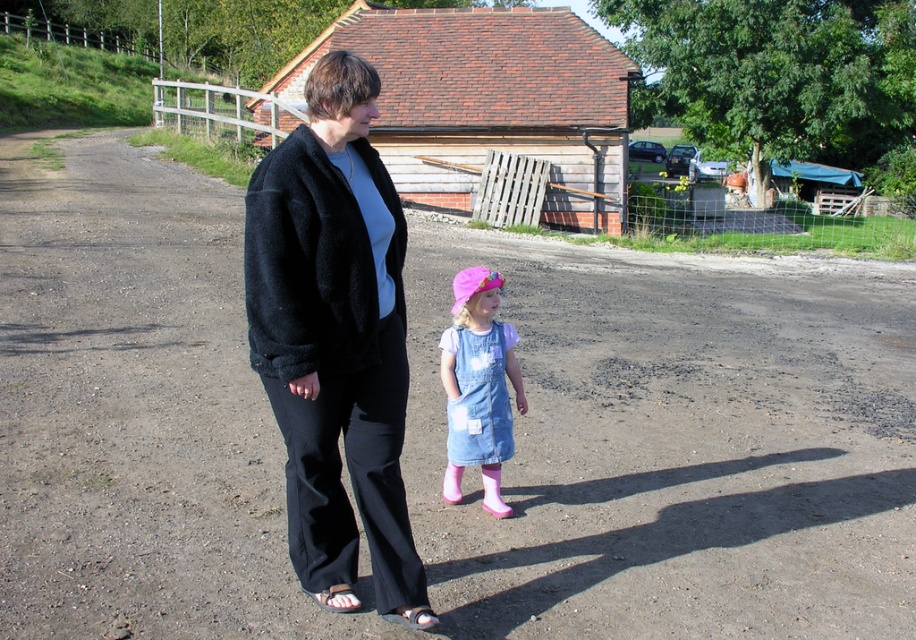
Is black fuzzy jacket at center to the right of white fabric sandal at lower left from the viewer's perspective?

Indeed, black fuzzy jacket at center is positioned on the right side of white fabric sandal at lower left.

Does black fuzzy jacket at center appear over white fabric sandal at lower left?

Yes, black fuzzy jacket at center is above white fabric sandal at lower left.

Is point (354, 241) positioned before point (326, 609)?

Yes.

This screenshot has height=640, width=916. Find the location of `black fuzzy jacket at center`. black fuzzy jacket at center is located at coordinates (334, 333).

Can you confirm if denim overall at lower right is positioned to the left of black leather sandal at lower center?

Incorrect, denim overall at lower right is not on the left side of black leather sandal at lower center.

Between denim overall at lower right and black leather sandal at lower center, which one is positioned lower?

black leather sandal at lower center

I want to click on denim overall at lower right, so (x=478, y=385).

What are the coordinates of `denim overall at lower right` in the screenshot? It's located at (478, 385).

Can you confirm if black fuzzy jacket at center is bigger than black leather sandal at lower center?

Correct, black fuzzy jacket at center is larger in size than black leather sandal at lower center.

Measure the distance between black fuzzy jacket at center and black leather sandal at lower center.

black fuzzy jacket at center and black leather sandal at lower center are 22.38 inches apart from each other.

Which is behind, point (284, 396) or point (422, 627)?

Point (422, 627)

Identify the location of black fuzzy jacket at center. (334, 333).